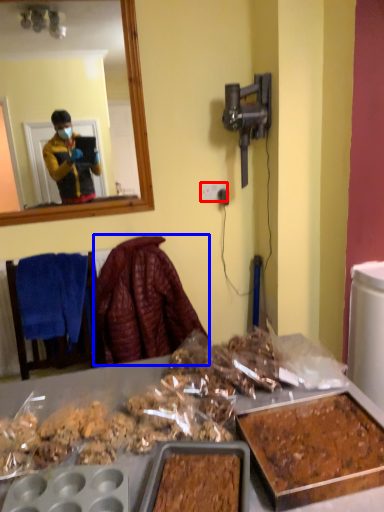
Question: Which object is closer to the camera taking this photo, power outlet (highlighted by a red box) or blanket (highlighted by a blue box)?

Choices:
 (A) power outlet
 (B) blanket

Answer: (B)